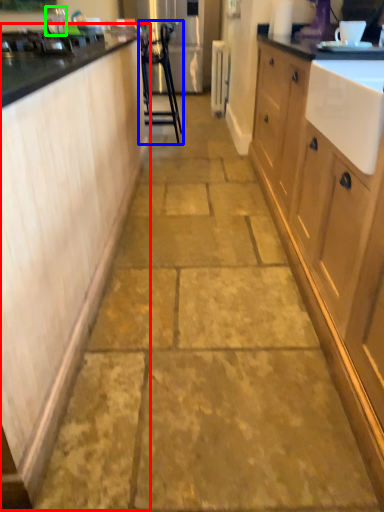
Question: Considering the real-world distances, which object is farthest from cabinetry (highlighted by a red box)? furniture (highlighted by a blue box) or faucet (highlighted by a green box)?

Choices:
 (A) furniture
 (B) faucet

Answer: (A)